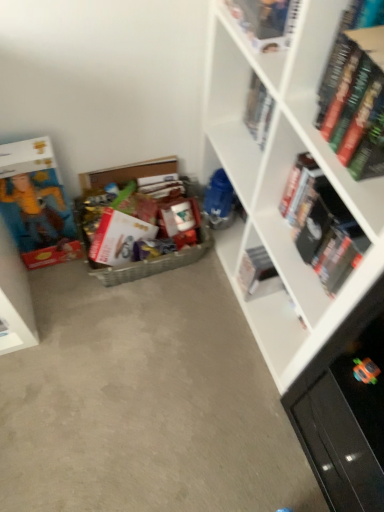
At what (x,y) coordinates should I click in order to perform the action: click on vacant point above matte cardboard box at center (from a real-world perspective). Please return your answer as a coordinate pair (x, y). The image size is (384, 512). Looking at the image, I should click on (151, 371).